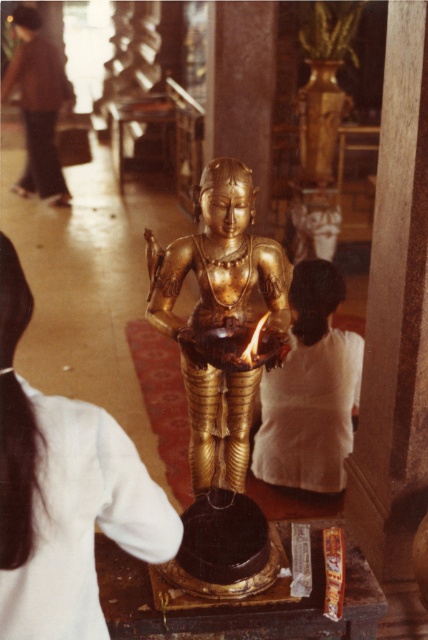
Consider the image. Does gold polished statue at center have a greater height compared to white cotton robe at center?

Indeed, gold polished statue at center has a greater height compared to white cotton robe at center.

Between point (234, 339) and point (288, 404), which one is positioned in front?

Point (234, 339) is more forward.

Does point (249, 564) come farther from viewer compared to point (350, 365)?

No, it is in front of (350, 365).

You are a GUI agent. You are given a task and a screenshot of the screen. Output one action in this format:
    pyautogui.click(x=<x>, y=<y>)
    Task: Click on the gold polished statue at center
    This screenshot has width=428, height=640.
    Given the screenshot: What is the action you would take?
    pyautogui.click(x=222, y=378)

Can you confirm if gold polished statue at center is smaller than dark brown fabric pants at upper left?

Correct, gold polished statue at center occupies less space than dark brown fabric pants at upper left.

Consider the image. Which is more to the right, gold polished statue at center or dark brown fabric pants at upper left?

Positioned to the right is gold polished statue at center.

Is point (223, 371) in front of point (30, 60)?

Yes.

Locate an element on the screen. The image size is (428, 640). gold polished statue at center is located at coordinates (222, 378).

Does white cotton robe at center appear on the right side of dark brown fabric pants at upper left?

Indeed, white cotton robe at center is positioned on the right side of dark brown fabric pants at upper left.

Which is more to the left, white cotton robe at center or dark brown fabric pants at upper left?

dark brown fabric pants at upper left is more to the left.

Locate an element on the screen. The image size is (428, 640). white cotton robe at center is located at coordinates (309, 413).